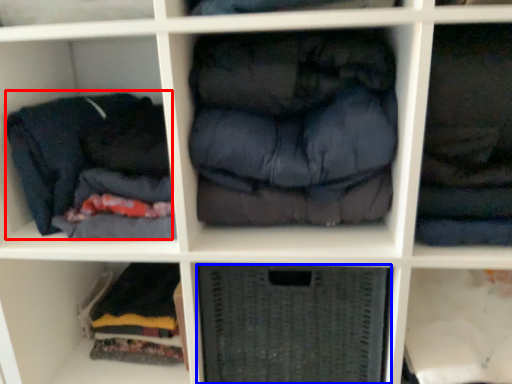
Question: Which point is further to the camera, clothing (highlighted by a red box) or shelf (highlighted by a blue box)?

Choices:
 (A) clothing
 (B) shelf

Answer: (B)